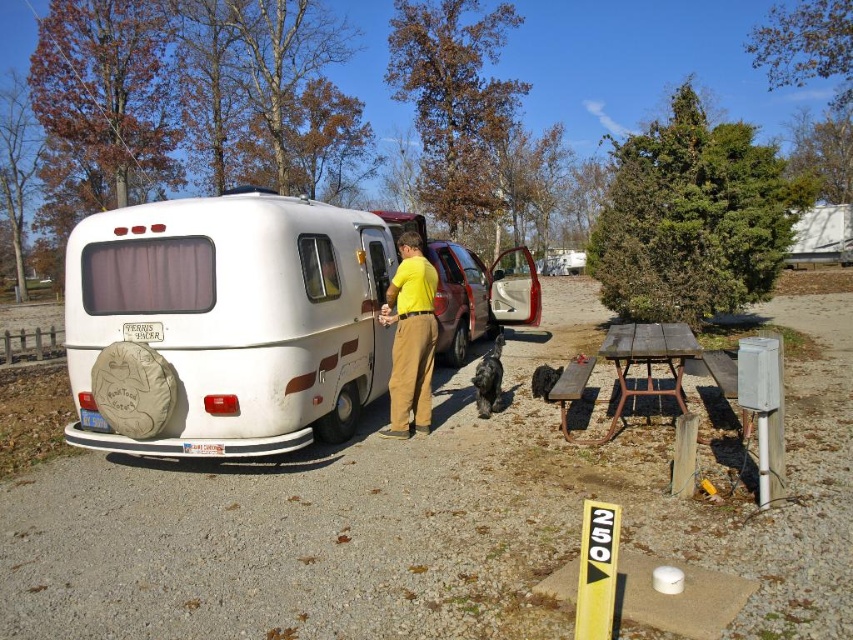
You are standing at the yellow signpost marked 250 and want to walk to the vintage travel trailer. Which direction should you go first, towards point (91,282) or point (630,392)?

You should go towards point (91,282) first because it is closer to you than point (630,392).

You are a hiker who just arrived at the campground and want to find your assigned spot. You see a yellow cotton shirt at center and a weathered wood picnic table at lower right. Which object is closer to you?

The yellow cotton shirt at center is closer to you because it has a smaller size compared to the weathered wood picnic table at lower right, which suggests it is farther away.